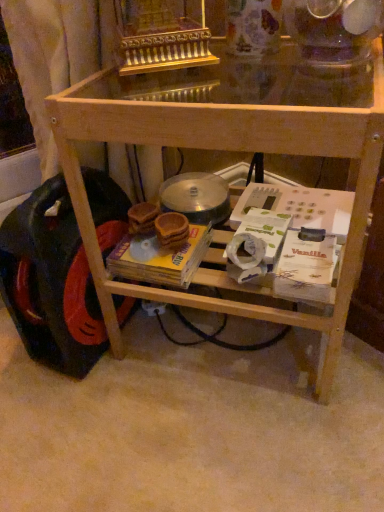
Question: Should I look upward or downward to see natural wood table at center?

Choices:
 (A) down
 (B) up

Answer: (B)

Question: Is natural wood table at center to the left of yellow cardboard magazine at center from the viewer's perspective?

Choices:
 (A) no
 (B) yes

Answer: (A)

Question: Is natural wood table at center not near yellow cardboard magazine at center?

Choices:
 (A) yes
 (B) no

Answer: (B)

Question: Are natural wood table at center and yellow cardboard magazine at center making contact?

Choices:
 (A) yes
 (B) no

Answer: (B)

Question: Does natural wood table at center have a greater width compared to yellow cardboard magazine at center?

Choices:
 (A) yes
 (B) no

Answer: (A)

Question: Is natural wood table at center closer to camera compared to yellow cardboard magazine at center?

Choices:
 (A) no
 (B) yes

Answer: (B)

Question: Could you tell me if natural wood table at center is turned towards yellow cardboard magazine at center?

Choices:
 (A) yes
 (B) no

Answer: (A)

Question: From the image's perspective, is black rubber wheel at lower left on top of natural wood table at center?

Choices:
 (A) yes
 (B) no

Answer: (B)

Question: Considering the relative positions of black rubber wheel at lower left and natural wood table at center in the image provided, is black rubber wheel at lower left in front of natural wood table at center?

Choices:
 (A) yes
 (B) no

Answer: (B)

Question: Is black rubber wheel at lower left smaller than natural wood table at center?

Choices:
 (A) no
 (B) yes

Answer: (B)

Question: Considering the relative sizes of black rubber wheel at lower left and natural wood table at center in the image provided, is black rubber wheel at lower left bigger than natural wood table at center?

Choices:
 (A) yes
 (B) no

Answer: (B)

Question: Is black rubber wheel at lower left turned away from natural wood table at center?

Choices:
 (A) yes
 (B) no

Answer: (B)

Question: Is black rubber wheel at lower left not inside natural wood table at center?

Choices:
 (A) no
 (B) yes

Answer: (B)

Question: Is yellow cardboard magazine at center smaller than black rubber wheel at lower left?

Choices:
 (A) yes
 (B) no

Answer: (A)